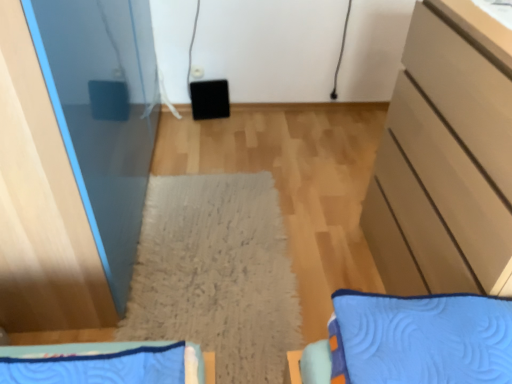
Image resolution: width=512 pixels, height=384 pixels. I want to click on free region on the left part of matte beige cabinet at right, so click(329, 254).